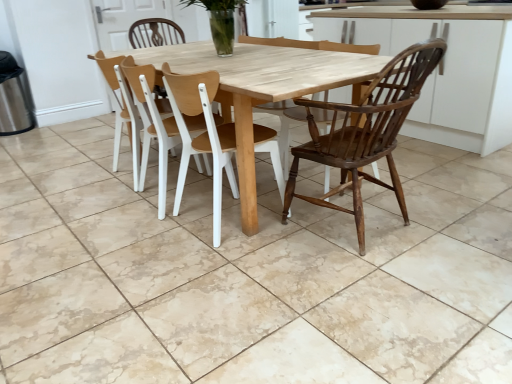
Find the location of a particular element. free space in front of wooden at center, arranged as the first chair when viewed from the left is located at coordinates coord(106,204).